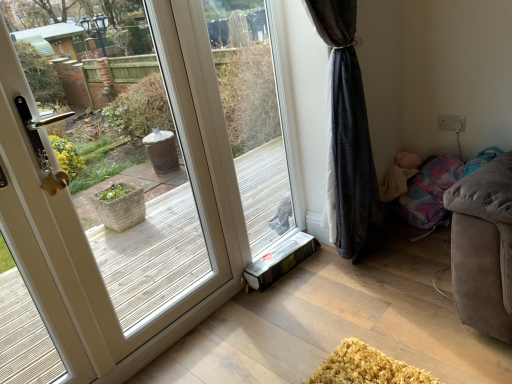
Measure the distance between soft beige blanket at lower right and camera.

A distance of 7.67 feet exists between soft beige blanket at lower right and camera.

The height and width of the screenshot is (384, 512). I want to click on soft beige blanket at lower right, so click(x=399, y=175).

Which object is positioned more to the right, soft beige blanket at lower right or white glossy door at left?

From the viewer's perspective, soft beige blanket at lower right appears more on the right side.

How different are the orientations of soft beige blanket at lower right and white glossy door at left in degrees?

The angular difference between soft beige blanket at lower right and white glossy door at left is 92.6 degrees.

Could white glossy door at left be considered to be inside soft beige blanket at lower right?

Actually, white glossy door at left is outside soft beige blanket at lower right.

Is transparent glass window at center placed right next to white glossy door at left?

transparent glass window at center is not next to white glossy door at left, and they're not touching.

Which of these two, transparent glass window at center or white glossy door at left, is thinner?

transparent glass window at center.

Which of these two, transparent glass window at center or white glossy door at left, stands taller?

white glossy door at left.

Does transparent glass window at center come behind white glossy door at left?

That is True.

Does white glossy door at left appear on the right side of soft beige blanket at lower right?

In fact, white glossy door at left is to the left of soft beige blanket at lower right.

Which of these two, white glossy door at left or soft beige blanket at lower right, is thinner?

white glossy door at left is thinner.

From a real-world perspective, is white glossy door at left positioned over soft beige blanket at lower right based on gravity?

Yes, from a real-world perspective, white glossy door at left is on top of soft beige blanket at lower right.

Can you confirm if soft beige blanket at lower right is positioned to the right of transparent glass window at center?

Indeed, soft beige blanket at lower right is positioned on the right side of transparent glass window at center.

Is soft beige blanket at lower right oriented away from transparent glass window at center?

No, soft beige blanket at lower right's orientation is not away from transparent glass window at center.

Is soft beige blanket at lower right next to transparent glass window at center and touching it?

No, soft beige blanket at lower right is not beside transparent glass window at center.

From the image's perspective, is soft beige blanket at lower right located above or below transparent glass window at center?

Clearly, from the image's perspective, soft beige blanket at lower right is below transparent glass window at center.

Between white glossy door at left and transparent glass window at center, which one has more height?

Standing taller between the two is white glossy door at left.

Which object is wider, white glossy door at left or transparent glass window at center?

Wider between the two is white glossy door at left.

Is white glossy door at left with transparent glass window at center?

They are not placed beside each other.

From a real-world perspective, who is located higher, white glossy door at left or transparent glass window at center?

white glossy door at left.

In terms of width, does transparent glass window at center look wider or thinner when compared to soft beige blanket at lower right?

Considering their sizes, transparent glass window at center looks slimmer than soft beige blanket at lower right.

How far apart are transparent glass window at center and soft beige blanket at lower right?

A distance of 30.74 inches exists between transparent glass window at center and soft beige blanket at lower right.

In order to click on window screen above the soft beige blanket at lower right (from a real-world perspective) in this screenshot , I will do `click(253, 117)`.

Looking at this image, is transparent glass window at center in front of or behind soft beige blanket at lower right in the image?

In the image, transparent glass window at center appears in front of soft beige blanket at lower right.

At what (x,y) coordinates should I click in order to perform the action: click on door above the soft beige blanket at lower right (from a real-world perspective). Please return your answer as a coordinate pair (x, y). Looking at the image, I should click on click(x=113, y=220).

At what (x,y) coordinates should I click in order to perform the action: click on door to the left of transparent glass window at center. Please return your answer as a coordinate pair (x, y). Looking at the image, I should click on (113, 220).

Estimate the real-world distances between objects in this image. Which object is further from transparent glass window at center, white glossy door at left or soft beige blanket at lower right?

white glossy door at left lies further to transparent glass window at center than the other object.

Based on their spatial positions, is soft beige blanket at lower right or white glossy door at left closer to transparent glass window at center?

soft beige blanket at lower right is positioned closer to the anchor transparent glass window at center.

Considering their positions, is transparent glass window at center positioned closer to white glossy door at left than soft beige blanket at lower right?

transparent glass window at center is positioned closer to the anchor white glossy door at left.

Based on their spatial positions, is white glossy door at left or transparent glass window at center closer to soft beige blanket at lower right?

Based on the image, transparent glass window at center appears to be nearer to soft beige blanket at lower right.

Estimate the real-world distances between objects in this image. Which object is closer to white glossy door at left, soft beige blanket at lower right or transparent glass window at center?

Based on the image, transparent glass window at center appears to be nearer to white glossy door at left.

When comparing their distances from soft beige blanket at lower right, does transparent glass window at center or white glossy door at left seem closer?

transparent glass window at center is closer to soft beige blanket at lower right.

At what (x,y) coordinates should I click in order to perform the action: click on window screen located between white glossy door at left and soft beige blanket at lower right in the left-right direction. Please return your answer as a coordinate pair (x, y). Looking at the image, I should click on (253, 117).